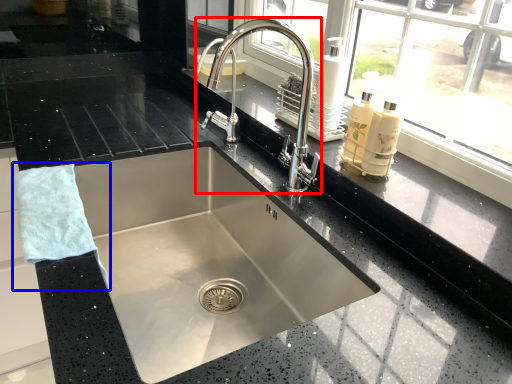
Question: Which point is closer to the camera, tap (highlighted by a red box) or hand towel (highlighted by a blue box)?

Choices:
 (A) tap
 (B) hand towel

Answer: (B)